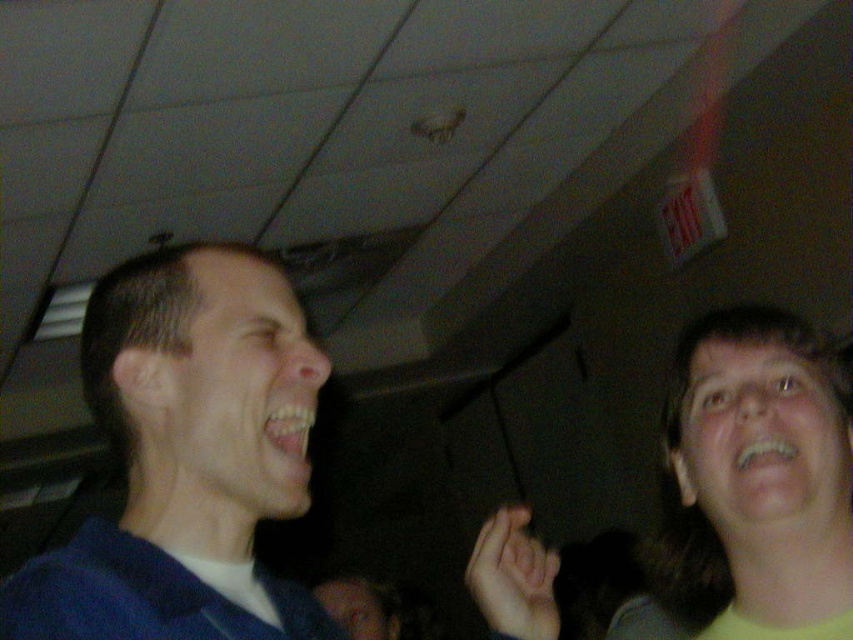
You are standing in the room and want to know which of the two points, point (730, 536) or point (514, 624), is nearer to you. Can you determine this based on their positions?

Point (730, 536) is closer to the camera than point (514, 624), so it is nearer to you.

You are a photographer trying to capture a candid shot of both the blue fabric shirt at left and the yellow matte face at upper right. Based on their positions, which subject should you focus on first to ensure both are in frame?

The blue fabric shirt at left is to the left of yellow matte face at upper right, so you should focus on the blue fabric shirt at left first to ensure both are in frame.